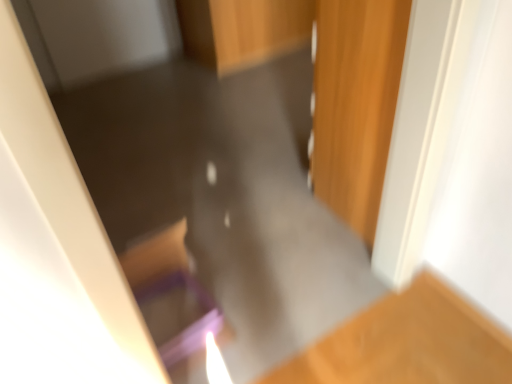
What are the coordinates of `free space to the left of wooden door at right` in the screenshot? It's located at (301, 228).